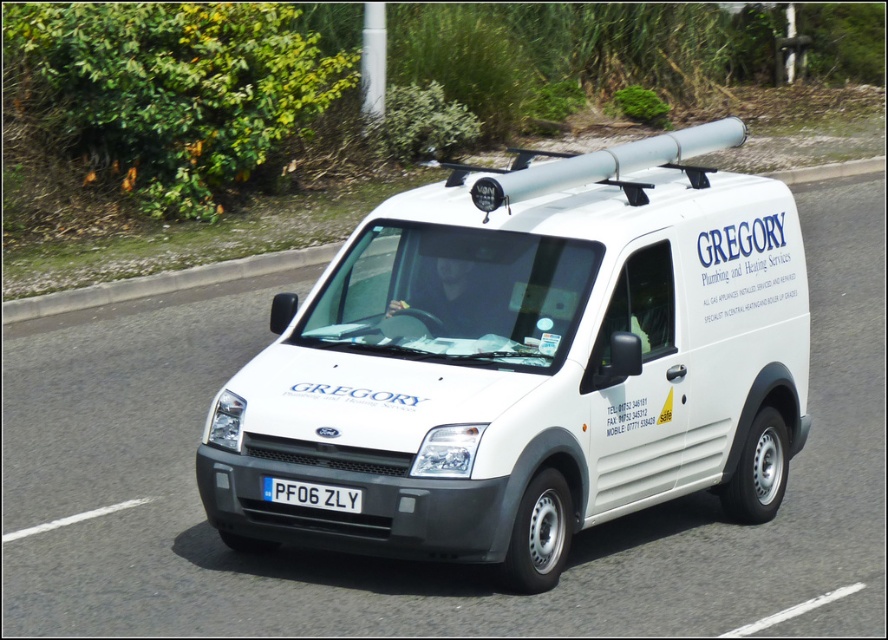
Consider the image. You are standing at a crosswalk and see the white matte van at center approaching. The crosswalk is 5 meters wide. If the van is 6.87 meters away from you, will it be able to stop before reaching the crosswalk?

The white matte van at center and camera are 6.87 meters apart. Since the crosswalk is 5 meters wide, the van is already closer than the crosswalk width, so it may not be able to stop in time. However, this depends on the van driver and road conditions.

You are a parking attendant and need to ensure that the white matte van at center can fit into a parking spot that is exactly the width of the white plastic license plate at center. Can the van fit without any part of it extending beyond the parking spot?

The white matte van at center might be wider than white plastic license plate at center, so it is uncertain if it can fit without extending beyond the parking spot.

You are standing on the sidewalk next to the road where the white Ford Transit Connect van is driving. You want to take a photo of the van but need to ensure you can capture the entire vehicle in the frame. If your camera has a field of view that can capture objects up to 8 meters away, will the point at coordinates point (500, 273) be within the camera frame?

The distance of point (500, 273) from the viewer is 7.74 meters, which is within the camera frame since it is less than 8 meters.